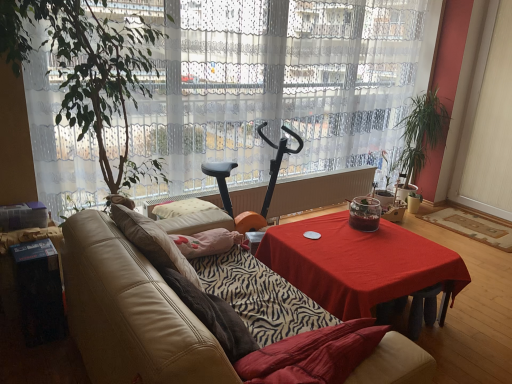
Question: In terms of width, does green leafy plant at left, arranged as the first houseplant when viewed from the left, look wider or thinner when compared to red cloth-covered table at center?

Choices:
 (A) wide
 (B) thin

Answer: (B)

Question: From a real-world perspective, is green leafy plant at left, placed as the 2th houseplant when sorted from right to left, positioned above or below red cloth-covered table at center?

Choices:
 (A) above
 (B) below

Answer: (A)

Question: Which of these objects is positioned closest to the green leafy plant at right, the 1th houseplant when ordered from back to front?

Choices:
 (A) leather couch at center
 (B) white sheer curtain at center
 (C) green leafy plant at left, placed as the 2th houseplant when sorted from back to front
 (D) white plastic radiator at center
 (E) red cloth-covered table at center

Answer: (D)

Question: Estimate the real-world distances between objects in this image. Which object is farther from the white plastic radiator at center?

Choices:
 (A) black plastic exercise bike at center
 (B) green leafy plant at left, placed as the 2th houseplant when sorted from back to front
 (C) white sheer curtain at center
 (D) red cloth-covered table at center
 (E) green leafy plant at right, which is the second houseplant from front to back

Answer: (B)